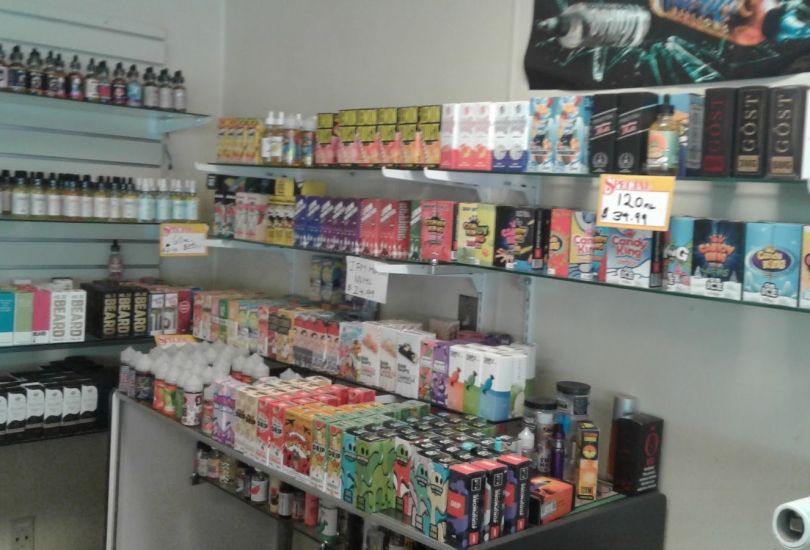
This screenshot has width=810, height=550. I want to click on outlet cover, so click(x=257, y=392), click(x=24, y=534).